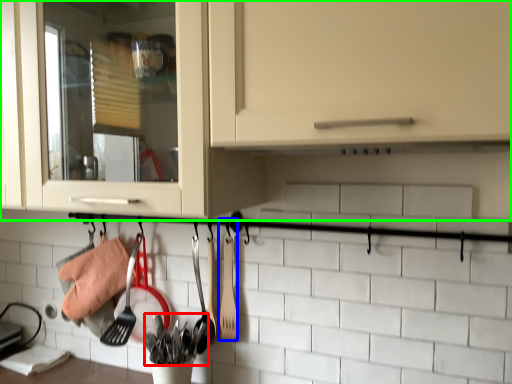
Question: Considering the real-world distances, which object is closest to silverware (highlighted by a red box)? spatula (highlighted by a blue box) or cabinetry (highlighted by a green box).

Choices:
 (A) spatula
 (B) cabinetry

Answer: (A)